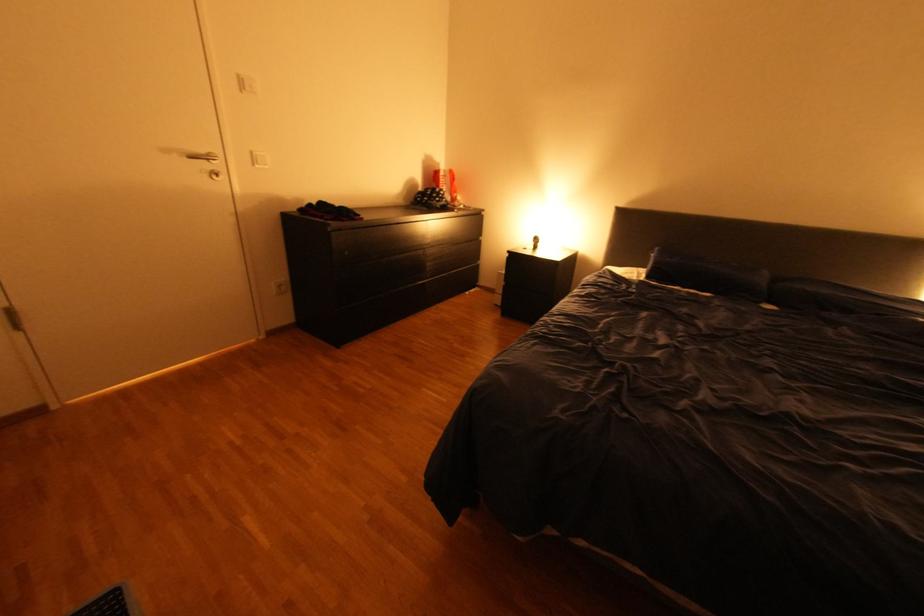
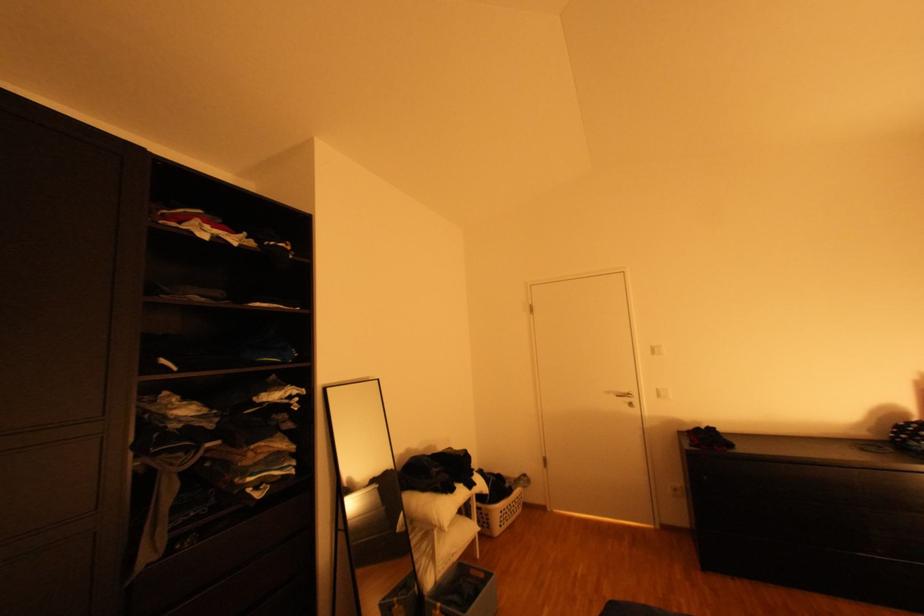
The point at (x=357, y=253) is marked in the first image. Where is the corresponding point in the second image?

(715, 477)